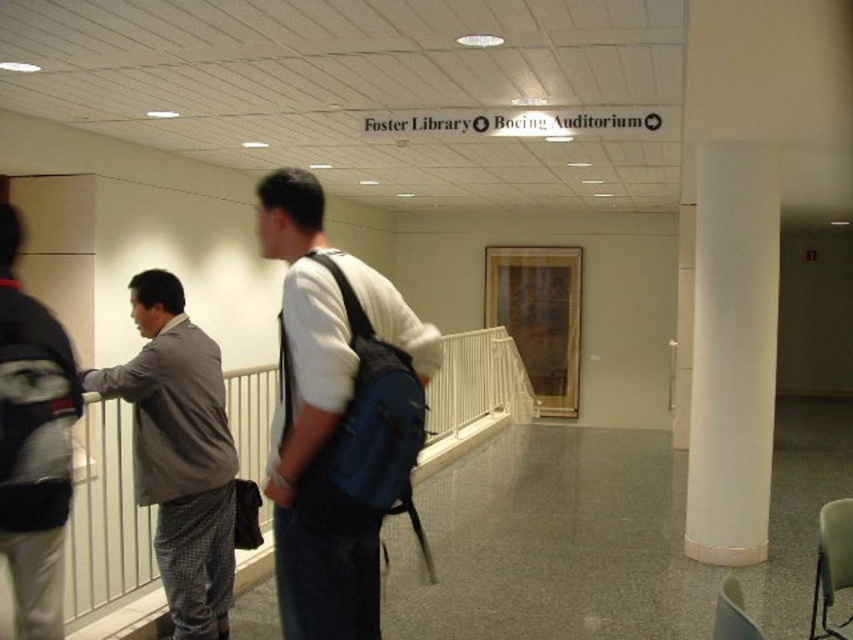
Question: Does gray fabric suit at left come in front of metallic gray chair at lower right?

Choices:
 (A) no
 (B) yes

Answer: (A)

Question: Is matte blue backpack at center wider than white glossy column at right?

Choices:
 (A) no
 (B) yes

Answer: (A)

Question: Can you confirm if gray fabric suit at left is positioned to the right of metallic gray chair at lower right?

Choices:
 (A) no
 (B) yes

Answer: (A)

Question: Estimate the real-world distances between objects in this image. Which object is closer to the white plastic rail at center?

Choices:
 (A) white plastic chair at lower right
 (B) matte blue backpack at center
 (C) metallic gray chair at lower right
 (D) gray fabric jacket at left

Answer: (D)

Question: Estimate the real-world distances between objects in this image. Which object is farther from the gray fabric jacket at left?

Choices:
 (A) matte blue backpack at center
 (B) gray fabric suit at left
 (C) metallic gray chair at lower right
 (D) white plastic rail at center

Answer: (D)

Question: Which of the following is the farthest from the observer?

Choices:
 (A) (770, 428)
 (B) (732, 625)
 (C) (21, 604)
 (D) (323, 369)

Answer: (A)